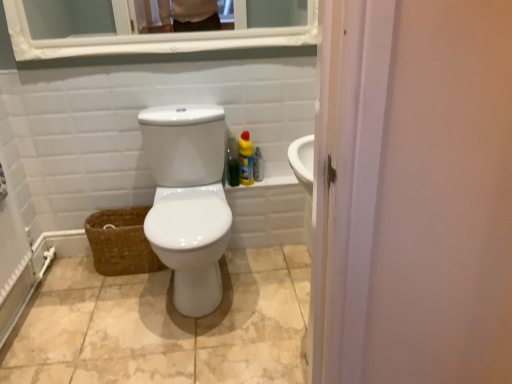
Question: Could clear plastic spray bottle at right, which appears as the second cleaning product when viewed from the left, be considered to be inside yellow matte bottle at right, the second cleaning product from the right?

Choices:
 (A) no
 (B) yes

Answer: (A)

Question: From the image's perspective, is yellow matte bottle at right, which is the first cleaning product in left-to-right order, above clear plastic spray bottle at right, the 1th cleaning product when ordered from right to left?

Choices:
 (A) yes
 (B) no

Answer: (A)

Question: Considering the relative sizes of yellow matte bottle at right, which is the first cleaning product in left-to-right order, and clear plastic spray bottle at right, which appears as the second cleaning product when viewed from the left, in the image provided, is yellow matte bottle at right, which is the first cleaning product in left-to-right order, thinner than clear plastic spray bottle at right, which appears as the second cleaning product when viewed from the left,?

Choices:
 (A) yes
 (B) no

Answer: (B)

Question: Is yellow matte bottle at right, the second cleaning product from the right, taller than clear plastic spray bottle at right, the 1th cleaning product when ordered from right to left?

Choices:
 (A) no
 (B) yes

Answer: (B)

Question: Is yellow matte bottle at right, which is the first cleaning product in left-to-right order, facing away from clear plastic spray bottle at right, the 1th cleaning product when ordered from right to left?

Choices:
 (A) no
 (B) yes

Answer: (A)

Question: Visually, is clear plastic spray bottle at right, which appears as the second cleaning product when viewed from the left, positioned to the left or to the right of white glossy toilet at center?

Choices:
 (A) left
 (B) right

Answer: (B)

Question: Considering the positions of clear plastic spray bottle at right, the 1th cleaning product when ordered from right to left, and white glossy toilet at center in the image, is clear plastic spray bottle at right, the 1th cleaning product when ordered from right to left, wider or thinner than white glossy toilet at center?

Choices:
 (A) wide
 (B) thin

Answer: (B)

Question: From their relative heights in the image, would you say clear plastic spray bottle at right, which appears as the second cleaning product when viewed from the left, is taller or shorter than white glossy toilet at center?

Choices:
 (A) tall
 (B) short

Answer: (B)

Question: Which is correct: clear plastic spray bottle at right, which appears as the second cleaning product when viewed from the left, is inside white glossy toilet at center, or outside of it?

Choices:
 (A) inside
 (B) outside

Answer: (B)

Question: Relative to beige ceramic tile at center, is white glossy medicine cabinet at upper center in front or behind?

Choices:
 (A) front
 (B) behind

Answer: (B)

Question: Is white glossy medicine cabinet at upper center taller or shorter than beige ceramic tile at center?

Choices:
 (A) short
 (B) tall

Answer: (B)

Question: Is white glossy medicine cabinet at upper center inside or outside of beige ceramic tile at center?

Choices:
 (A) outside
 (B) inside

Answer: (A)

Question: Looking at their shapes, would you say white glossy medicine cabinet at upper center is wider or thinner than beige ceramic tile at center?

Choices:
 (A) wide
 (B) thin

Answer: (B)

Question: Is point (99, 210) positioned closer to the camera than point (259, 175)?

Choices:
 (A) farther
 (B) closer

Answer: (A)

Question: Relative to clear plastic spray bottle at right, which appears as the second cleaning product when viewed from the left, is brown woven basket at lower left in front or behind?

Choices:
 (A) behind
 (B) front

Answer: (B)